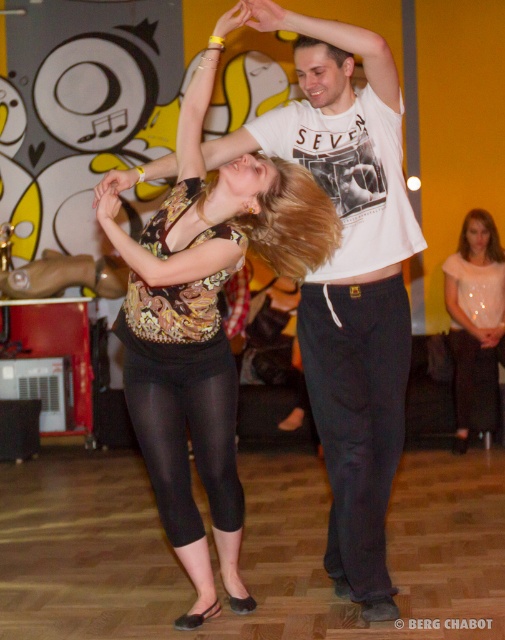
You are a photographer at the dance event. You want to take a photo of the matte black leggings at center and the matte white blouse at lower right. Which object should you focus on first if you want to capture both in the same frame without moving the camera?

The matte black leggings at center is to the left of matte white blouse at lower right, so you should focus on the matte black leggings at center first since it is positioned to the left and closer to the camera, allowing both to be captured in the frame without moving the camera.

You are a photographer setting up a camera in the dance studio. You need to capture both the matte black leggings at center and the matte white blouse at lower right in your shot. Which object should you focus on first if you want to ensure both are in frame without moving the camera?

The matte black leggings at center is bigger than the matte white blouse at lower right, so you should focus on the matte black leggings at center first to ensure it fits within the frame before adjusting for the smaller matte white blouse at lower right.